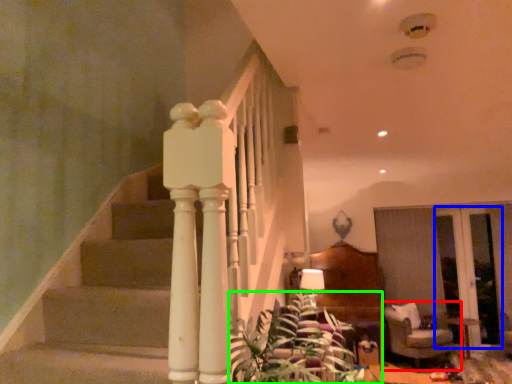
Question: Which is nearer to the furniture (highlighted by a red box)? glass door (highlighted by a blue box) or plant (highlighted by a green box).

Choices:
 (A) glass door
 (B) plant

Answer: (A)